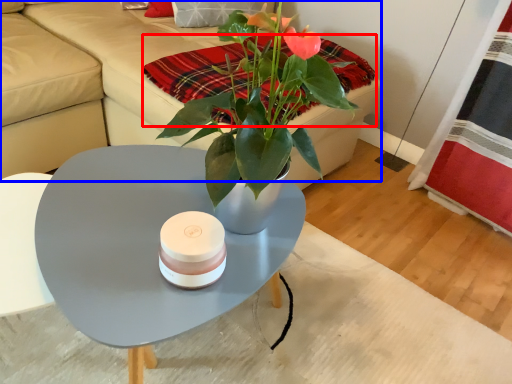
Question: Which point is further to the camera, blanket (highlighted by a red box) or couch (highlighted by a blue box)?

Choices:
 (A) blanket
 (B) couch

Answer: (A)